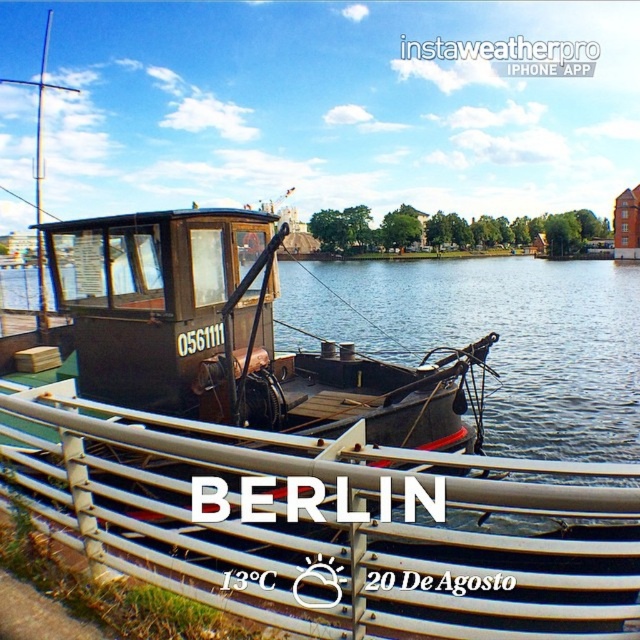
Between metal/rustic rail at lower center and rusty metal boat at center, which one appears on the right side from the viewer's perspective?

rusty metal boat at center is more to the right.

Which of these two, metal/rustic rail at lower center or rusty metal boat at center, stands shorter?

rusty metal boat at center

Find the location of `metal/rustic rail at lower center`. metal/rustic rail at lower center is located at coordinates (x=324, y=525).